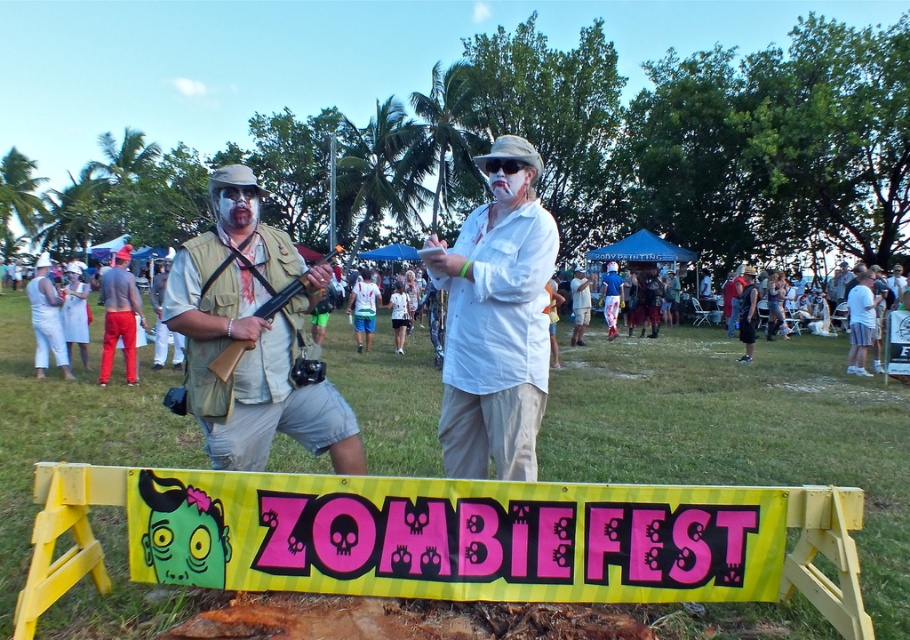
Question: Is yellow plastic banner at center below red cotton shorts at center?

Choices:
 (A) yes
 (B) no

Answer: (A)

Question: Does matte khaki vest at left lie in front of red cotton shorts at center?

Choices:
 (A) yes
 (B) no

Answer: (A)

Question: Which of the following is the farthest from the observer?

Choices:
 (A) (486, 317)
 (B) (239, 269)

Answer: (B)

Question: Considering the real-world distances, which object is closest to the white matte shirt at center?

Choices:
 (A) yellow plastic banner at center
 (B) matte khaki vest at left
 (C) red cotton shorts at center

Answer: (B)

Question: Which is farther from the yellow plastic banner at center?

Choices:
 (A) white matte shirt at center
 (B) matte khaki vest at left

Answer: (B)

Question: Is matte khaki vest at left further to camera compared to yellow plastic banner at center?

Choices:
 (A) yes
 (B) no

Answer: (A)